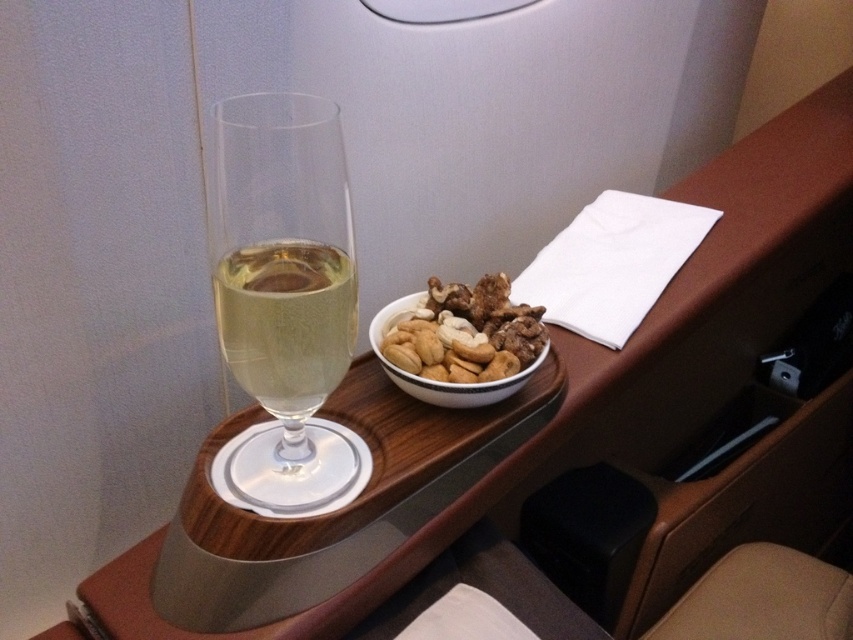
Question: Can you confirm if clear glass at center is positioned below shiny brown bowl at center?

Choices:
 (A) no
 (B) yes

Answer: (B)

Question: Which object is closer to the camera taking this photo?

Choices:
 (A) shiny brown bowl at center
 (B) clear glass wine glass at center
 (C) clear glass at center

Answer: (B)

Question: Which is farther from the clear glass at center?

Choices:
 (A) clear glass wine glass at center
 (B) shiny brown bowl at center

Answer: (B)

Question: Is clear glass wine glass at center further to camera compared to clear glass at center?

Choices:
 (A) yes
 (B) no

Answer: (B)

Question: Among these objects, which one is nearest to the camera?

Choices:
 (A) shiny brown bowl at center
 (B) clear glass at center

Answer: (B)

Question: Can you confirm if clear glass wine glass at center is thinner than clear glass at center?

Choices:
 (A) no
 (B) yes

Answer: (A)